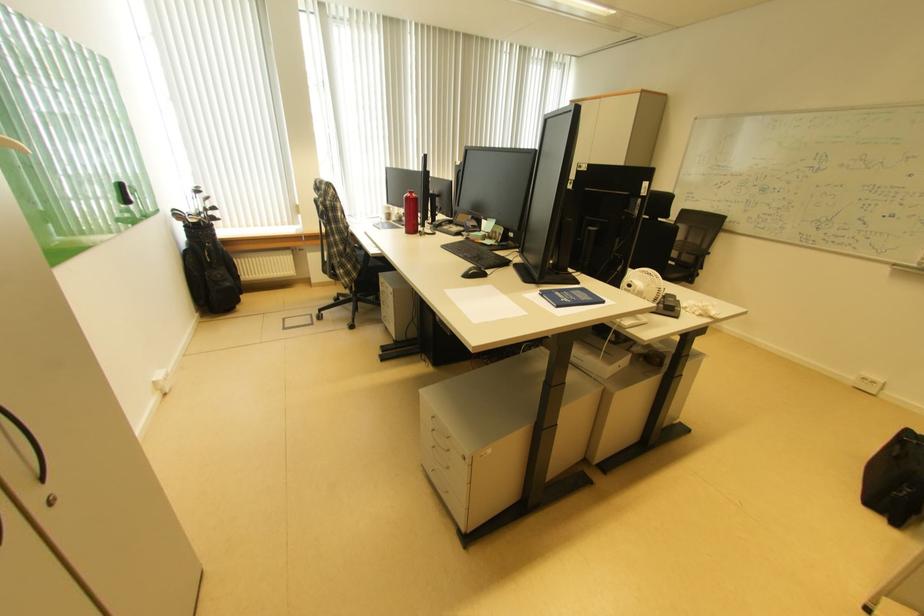
Locate an element on the screen. Image resolution: width=924 pixels, height=616 pixels. black keyboard is located at coordinates (476, 254).